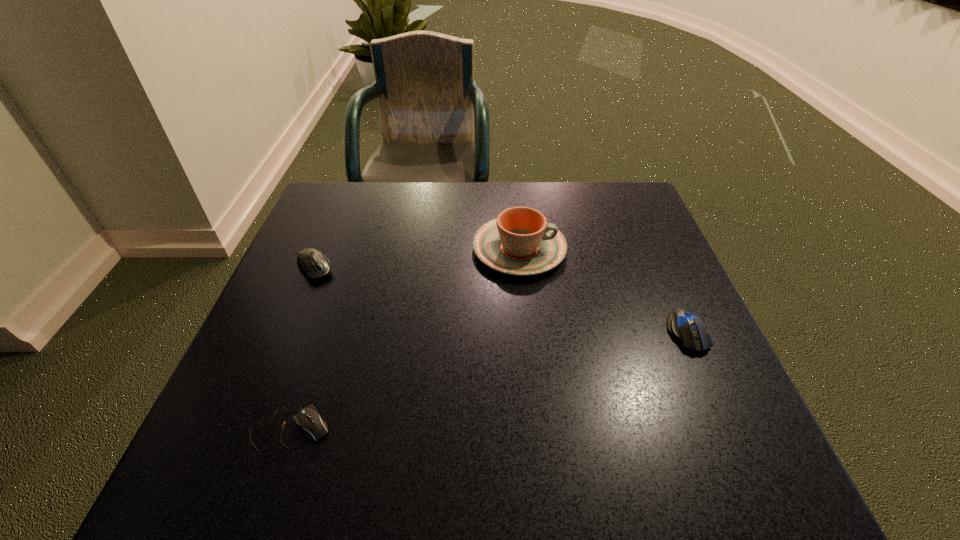
The width and height of the screenshot is (960, 540). I want to click on chinaware, so click(520, 242).

Image resolution: width=960 pixels, height=540 pixels. Find the location of `the third object from left to right`. the third object from left to right is located at coordinates (520, 242).

The image size is (960, 540). Find the location of `the third shortest object`. the third shortest object is located at coordinates (315, 265).

This screenshot has height=540, width=960. I want to click on the tallest computer mouse, so click(x=315, y=265).

Where is `the third tallest object`? Image resolution: width=960 pixels, height=540 pixels. the third tallest object is located at coordinates (683, 325).

Where is `the second farthest computer mouse`? The height and width of the screenshot is (540, 960). the second farthest computer mouse is located at coordinates (683, 325).

Where is `the nearest object`? The image size is (960, 540). the nearest object is located at coordinates (308, 418).

Find the location of a particular element. This screenshot has height=540, width=960. the shortest object is located at coordinates (308, 418).

This screenshot has width=960, height=540. Find the location of `vacant space located 0.180m on the handle side of the chinaware`. vacant space located 0.180m on the handle side of the chinaware is located at coordinates (638, 249).

The height and width of the screenshot is (540, 960). I want to click on vacant space located on the right of the farthest computer mouse, so click(x=424, y=269).